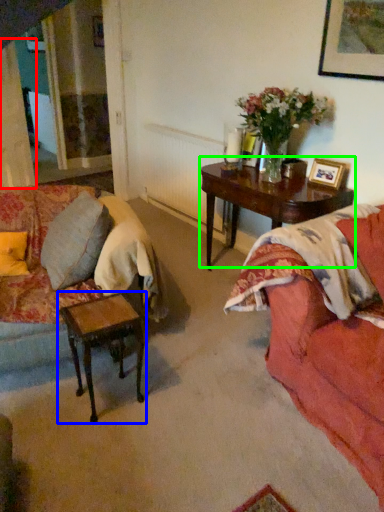
Question: Estimate the real-world distances between objects in this image. Which object is farther from curtain (highlighted by a red box), table (highlighted by a blue box) or coffee table (highlighted by a green box)?

Choices:
 (A) table
 (B) coffee table

Answer: (A)